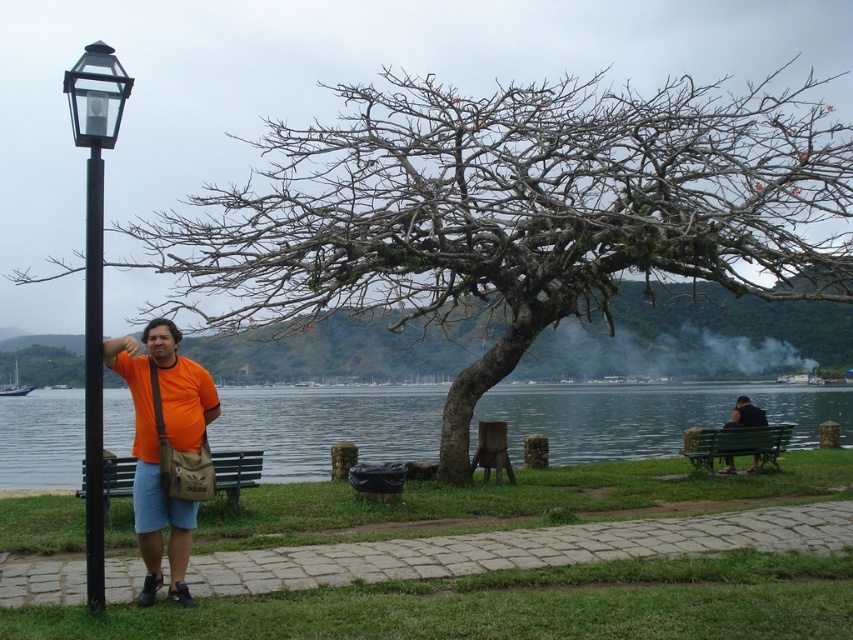
Which is above, orange fabric shirt at left or green wooden bench at right?

orange fabric shirt at left is above.

In the scene shown: Is orange fabric shirt at left positioned before green wooden bench at right?

Yes, orange fabric shirt at left is closer to the viewer.

Describe the element at coordinates (158, 445) in the screenshot. I see `orange fabric shirt at left` at that location.

Where is `orange fabric shirt at left`? orange fabric shirt at left is located at coordinates (158, 445).

Can you confirm if brown leather bench at lower left is thinner than black fabric person at right?

Indeed, brown leather bench at lower left has a lesser width compared to black fabric person at right.

You are a GUI agent. You are given a task and a screenshot of the screen. Output one action in this format:
    pyautogui.click(x=<x>, y=<y>)
    Task: Click on the brown leather bench at lower left
    Image resolution: width=853 pixels, height=640 pixels.
    Given the screenshot: What is the action you would take?
    pyautogui.click(x=236, y=472)

Is green mossy tree at center positioned before green water at bench right?

Yes, green mossy tree at center is in front of green water at bench right.

Can you confirm if green mossy tree at center is bigger than green water at bench right?

Correct, green mossy tree at center is larger in size than green water at bench right.

Is point (781, 180) more distant than point (706, 419)?

No, it is not.

This screenshot has height=640, width=853. Find the location of `green mossy tree at center`. green mossy tree at center is located at coordinates (514, 212).